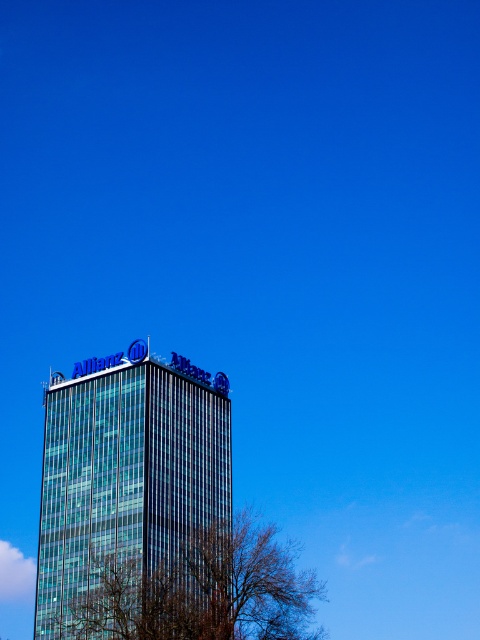
Who is lower down, transparent glass building at center or bare branches at lower center?

bare branches at lower center is lower down.

Who is more distant from viewer, (x=104, y=397) or (x=277, y=576)?

The point (x=104, y=397) is more distant.

You are a GUI agent. You are given a task and a screenshot of the screen. Output one action in this format:
    pyautogui.click(x=<x>, y=<y>)
    Task: Click on the transparent glass building at center
    
    Given the screenshot: What is the action you would take?
    pyautogui.click(x=126, y=470)